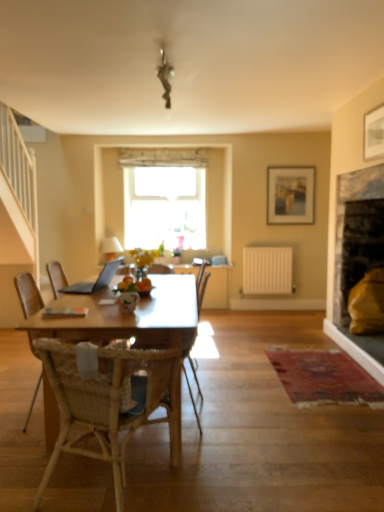
Locate an element on the screen. This screenshot has height=512, width=384. free space in front of white glossy vase at center is located at coordinates (129, 316).